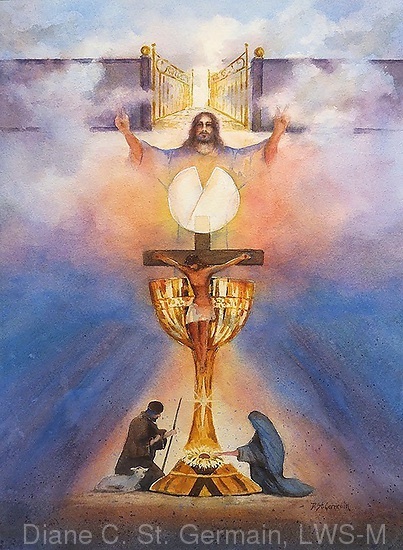
The height and width of the screenshot is (550, 403). I want to click on grey wall, so click(29, 106).